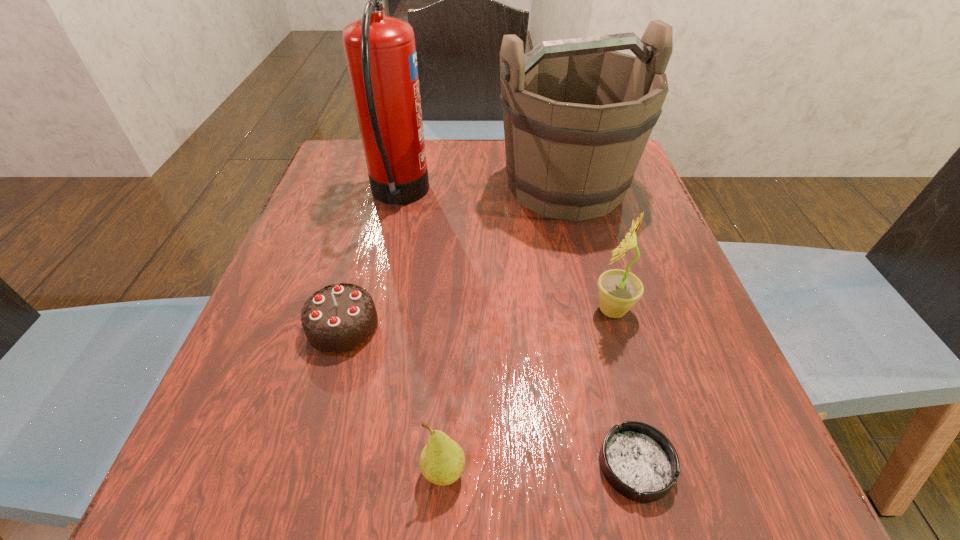
Where is `vacant space located on the face of the fourth shortest object`? This screenshot has height=540, width=960. vacant space located on the face of the fourth shortest object is located at coordinates pyautogui.click(x=401, y=310).

You are a GUI agent. You are given a task and a screenshot of the screen. Output one action in this format:
    pyautogui.click(x=<x>, y=<y>)
    Task: Click on the free point located 0.110m on the face of the fourth shortest object
    
    Given the screenshot: What is the action you would take?
    527,310

This screenshot has height=540, width=960. I want to click on vacant space situated 0.190m on the back of the third object from left to right, so click(451, 338).

At what (x,y) coordinates should I click in order to perform the action: click on free space located on the back of the chocolate cake. Please return your answer as a coordinate pair (x, y). This screenshot has width=960, height=540. Looking at the image, I should click on (366, 246).

You are a GUI agent. You are given a task and a screenshot of the screen. Output one action in this format:
    pyautogui.click(x=<x>, y=<y>)
    Task: Click on the vacant space located 0.370m on the left of the shortest object
    
    Given the screenshot: What is the action you would take?
    pyautogui.click(x=319, y=465)

I want to click on fire extinguisher that is at the far edge, so click(380, 51).

In order to click on bucket located in the far edge section of the desktop in this screenshot , I will do `click(577, 114)`.

At what (x,y) coordinates should I click in order to perform the action: click on pear that is at the near edge. Please return your answer as a coordinate pair (x, y). The height and width of the screenshot is (540, 960). Looking at the image, I should click on (442, 461).

Image resolution: width=960 pixels, height=540 pixels. I want to click on ashtray at the near edge, so click(638, 461).

Where is `fire extinguisher at the left edge`? The width and height of the screenshot is (960, 540). fire extinguisher at the left edge is located at coordinates (380, 51).